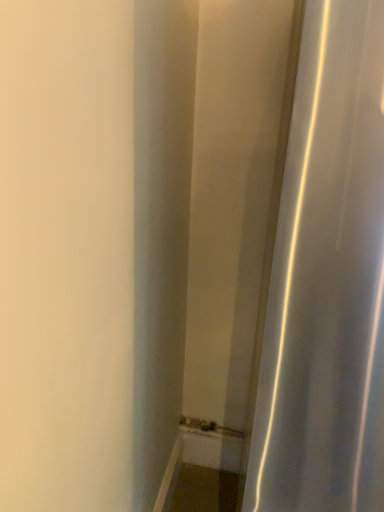
What do you see at coordinates (327, 280) in the screenshot? I see `white glossy curtain at right` at bounding box center [327, 280].

You are a GUI agent. You are given a task and a screenshot of the screen. Output one action in this format:
    pyautogui.click(x=<x>, y=<y>)
    Task: Click on the white glossy curtain at right
    
    Given the screenshot: What is the action you would take?
    pyautogui.click(x=327, y=280)

The image size is (384, 512). I want to click on white glossy curtain at right, so click(327, 280).